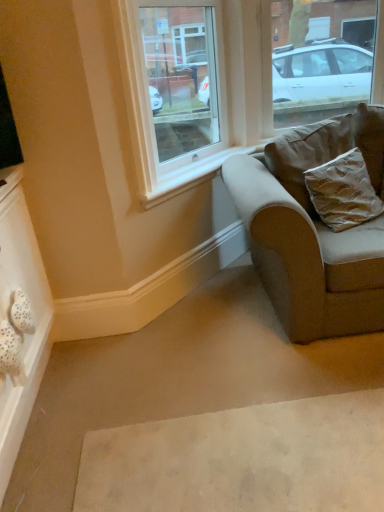
Question: Can you confirm if beige fabric couch at right is smaller than clear glass window at upper center, marked as the second window in a right-to-left arrangement?

Choices:
 (A) no
 (B) yes

Answer: (A)

Question: Considering the relative sizes of beige fabric couch at right and clear glass window at upper center, the 1th window when ordered from left to right, in the image provided, is beige fabric couch at right taller than clear glass window at upper center, the 1th window when ordered from left to right,?

Choices:
 (A) yes
 (B) no

Answer: (B)

Question: Can you confirm if beige fabric couch at right is shorter than clear glass window at upper center, the 1th window when ordered from left to right?

Choices:
 (A) yes
 (B) no

Answer: (A)

Question: From a real-world perspective, does beige fabric couch at right sit lower than clear glass window at upper center, marked as the second window in a right-to-left arrangement?

Choices:
 (A) no
 (B) yes

Answer: (B)

Question: Can you confirm if beige fabric couch at right is wider than clear glass window at upper center, marked as the second window in a right-to-left arrangement?

Choices:
 (A) yes
 (B) no

Answer: (A)

Question: From a real-world perspective, relative to beige fabric couch at right, is white fabric drawer at lower left vertically above or below?

Choices:
 (A) below
 (B) above

Answer: (B)

Question: Is point (34, 279) closer or farther from the camera than point (317, 239)?

Choices:
 (A) farther
 (B) closer

Answer: (A)

Question: Looking at their shapes, would you say white fabric drawer at lower left is wider or thinner than beige fabric couch at right?

Choices:
 (A) thin
 (B) wide

Answer: (A)

Question: Is white fabric drawer at lower left in front of or behind beige fabric couch at right in the image?

Choices:
 (A) behind
 (B) front

Answer: (B)

Question: Looking at their shapes, would you say gold textured pillow at right is wider or thinner than white fabric drawer at lower left?

Choices:
 (A) wide
 (B) thin

Answer: (A)

Question: Looking at the image, does gold textured pillow at right seem bigger or smaller compared to white fabric drawer at lower left?

Choices:
 (A) big
 (B) small

Answer: (A)

Question: Is gold textured pillow at right to the left or to the right of white fabric drawer at lower left in the image?

Choices:
 (A) left
 (B) right

Answer: (B)

Question: Relative to white fabric drawer at lower left, is gold textured pillow at right in front or behind?

Choices:
 (A) behind
 (B) front

Answer: (A)

Question: Looking at their shapes, would you say white fabric drawer at lower left is wider or thinner than clear glass window at upper center, marked as the second window in a right-to-left arrangement?

Choices:
 (A) thin
 (B) wide

Answer: (A)

Question: Choose the correct answer: Is white fabric drawer at lower left inside clear glass window at upper center, marked as the second window in a right-to-left arrangement, or outside it?

Choices:
 (A) outside
 (B) inside

Answer: (A)